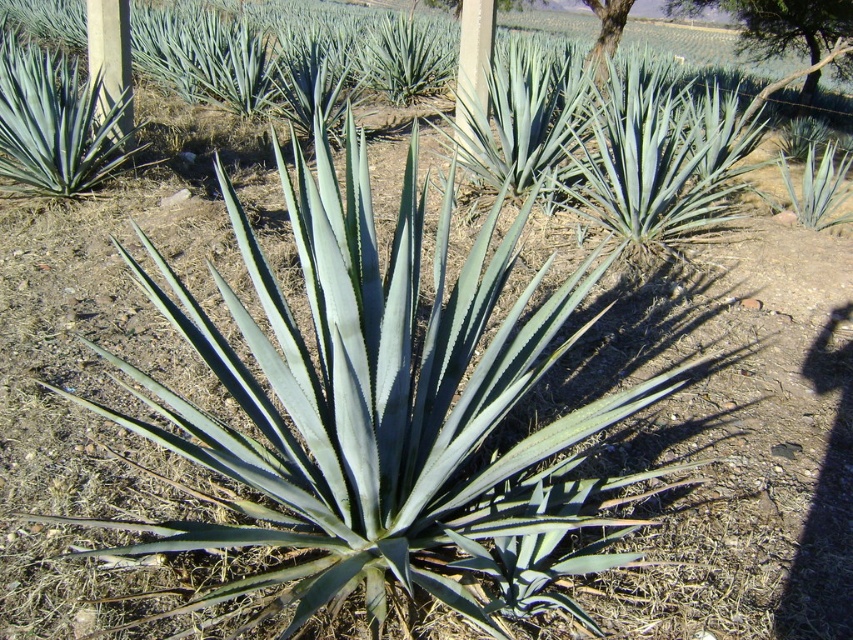
Can you confirm if smooth wood pole at center is positioned to the right of smooth bark tree at upper right?

In fact, smooth wood pole at center is to the left of smooth bark tree at upper right.

From the picture: Which of these two, smooth wood pole at center or smooth bark tree at upper right, stands shorter?

With less height is smooth wood pole at center.

Does point (468, 4) lie in front of point (608, 38)?

Yes, point (468, 4) is in front of point (608, 38).

The height and width of the screenshot is (640, 853). What are the coordinates of `smooth wood pole at center` in the screenshot? It's located at tap(473, 65).

Can you confirm if wooden post at upper left is wider than smooth bark tree at upper right?

Result: In fact, wooden post at upper left might be narrower than smooth bark tree at upper right.

Consider the image. Does wooden post at upper left appear under smooth bark tree at upper right?

Correct, wooden post at upper left is located below smooth bark tree at upper right.

The image size is (853, 640). Describe the element at coordinates (109, 60) in the screenshot. I see `wooden post at upper left` at that location.

Identify the location of wooden post at upper left. This screenshot has height=640, width=853. (109, 60).

Is wooden post at upper left shorter than smooth wood pole at center?

No, wooden post at upper left is not shorter than smooth wood pole at center.

Who is more distant from viewer, (103, 96) or (492, 35)?

The point (492, 35) is more distant.

Identify the location of wooden post at upper left. (109, 60).

You are a GUI agent. You are given a task and a screenshot of the screen. Output one action in this format:
    pyautogui.click(x=<x>, y=<y>)
    Task: Click on the wooden post at upper left
    The height and width of the screenshot is (640, 853).
    Given the screenshot: What is the action you would take?
    pyautogui.click(x=109, y=60)